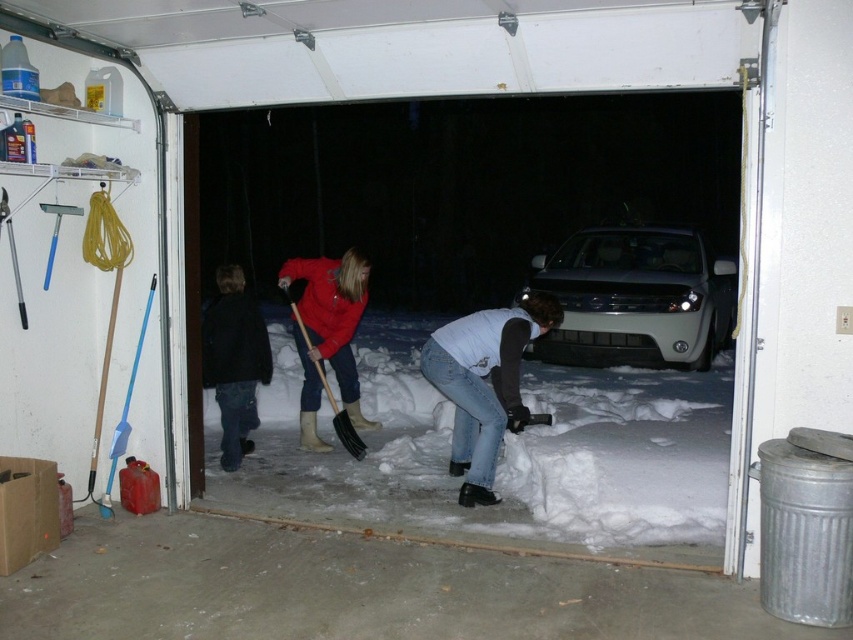
Question: Which of these objects is positioned farthest from the satin silver car at center?

Choices:
 (A) rubber boots at center
 (B) white matte jeans at lower center

Answer: (B)

Question: Which is nearer to the satin silver car at center?

Choices:
 (A) rubber boots at center
 (B) white fluffy snow at center
 (C) blue plastic shovel at left
 (D) black woolen jacket at center

Answer: (A)

Question: Is white fluffy snow at center wider than rubber boots at center?

Choices:
 (A) yes
 (B) no

Answer: (A)

Question: Can you confirm if white fluffy snow at center is positioned below black woolen jacket at center?

Choices:
 (A) yes
 (B) no

Answer: (A)

Question: Is white matte jeans at lower center above black woolen jacket at center?

Choices:
 (A) yes
 (B) no

Answer: (A)

Question: Which of the following is the closest to the observer?

Choices:
 (A) (469, 474)
 (B) (724, 259)

Answer: (A)